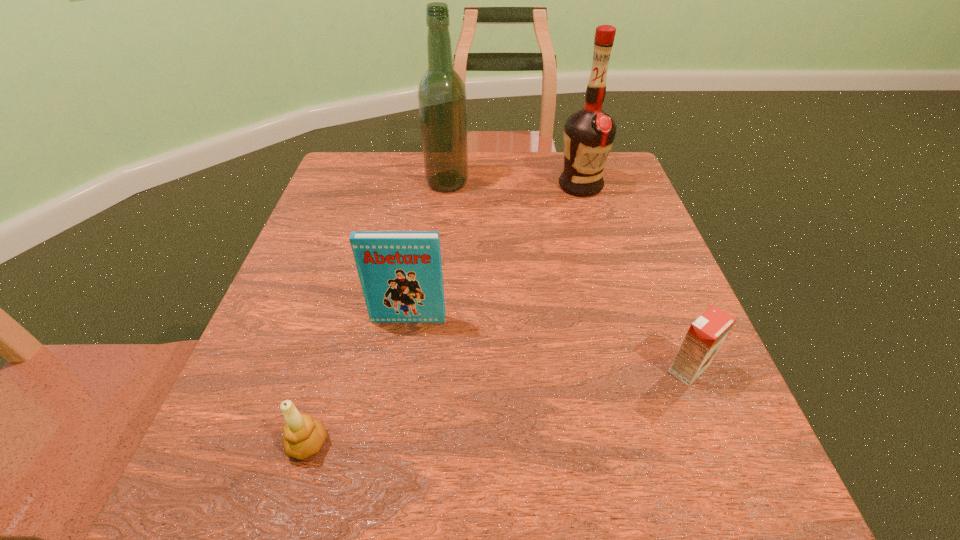
At what (x,y) coordinates should I click in order to perform the action: click on free area in between the left liquor and the orange juice. Please return your answer as a coordinate pair (x, y). Looking at the image, I should click on [567, 276].

Locate an element on the screen. This screenshot has width=960, height=540. object that is the third nearest to the fourth farthest object is located at coordinates (304, 436).

Choose which object is the nearest neighbor to the third shortest object. Please provide its 2D coordinates. Your answer should be formatted as a tuple, i.e. [(x, y)], where the tuple contains the x and y coordinates of a point satisfying the conditions above.

[(304, 436)]

This screenshot has width=960, height=540. I want to click on blank area in the image that satisfies the following two spatial constraints: 1. on the front and back of the right liquor; 2. on the right side of the fourth farthest object, so click(x=635, y=369).

Locate an element on the screen. Image resolution: width=960 pixels, height=540 pixels. vacant point that satisfies the following two spatial constraints: 1. on the back side of the candle_holder; 2. on the left side of the left liquor is located at coordinates (384, 183).

Image resolution: width=960 pixels, height=540 pixels. What are the coordinates of `vacant space that satisfies the following two spatial constraints: 1. on the front side of the left liquor; 2. on the right side of the fourth farthest object` in the screenshot? It's located at (429, 369).